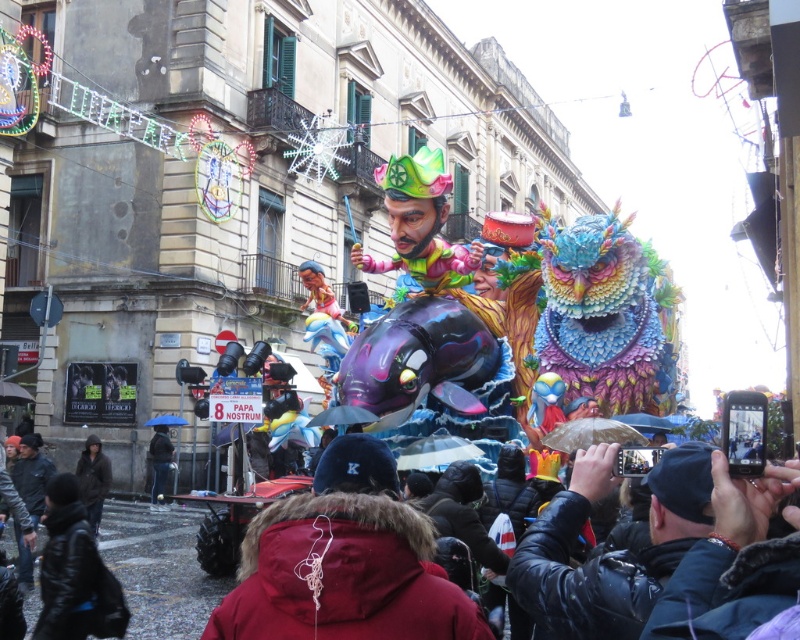
You are a photographer standing in the crowd at the parade. You want to take a photo of both the red fur coat at center and the dark blue leather jacket at lower right. Which object will appear larger in your photo?

The red fur coat at center will appear larger in the photo because it is closer to the viewer than the dark blue leather jacket at lower right.

You are a photographer trying to capture a photo of the red fur coat at center and the dark blue leather jacket at lower right. Based on their positions, which one is closer to the camera?

The red fur coat at center is below the dark blue leather jacket at lower right, so the dark blue leather jacket at lower right is closer to the camera.

You are a photographer trying to capture both the red fur coat at center and the dark brown leather jacket at lower left in a single frame. Given their sizes, which one will appear bigger in your photo?

The red fur coat at center will appear bigger in the photo since it has a larger size compared to the dark brown leather jacket at lower left.